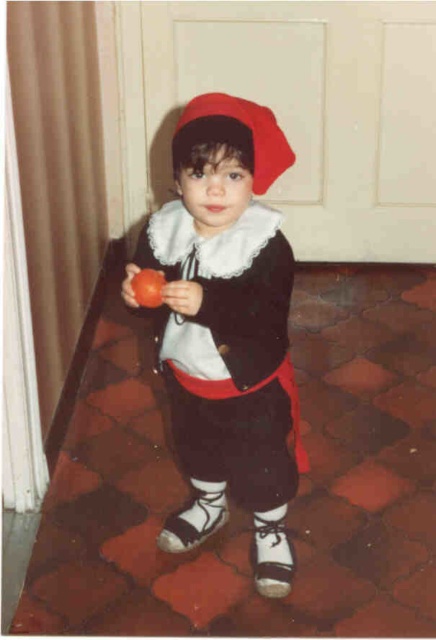
You are a photographer setting up a shoot in the described scene. You need to place a small prop exactly at the coordinates point 0.450, 0.339. Where should you position the prop relative to the smooth red tomato at center?

The smooth red tomato at center is located at point (147, 288), so you should position the prop exactly where the smooth red tomato at center is currently placed.

You are a photographer trying to capture the child in the scene. You notice two points in the image labeled as point 1 at coordinates point (152, 276) and point 2 at coordinates point (125, 291). If you want to focus on the point that is closer to you, which one should you choose?

Point (152, 276) is closer to the viewer than point (125, 291), so you should choose point (152, 276) to focus on.

In the scene shown: The child is holding two items. Which one is bigger, the matte black outfit at center or the matte red apple at center?

The matte black outfit at center is larger in size compared to the matte red apple at center.